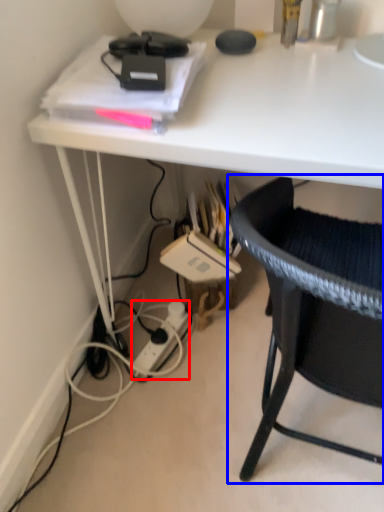
Question: Among these objects, which one is nearest to the camera, power outlet (highlighted by a red box) or chair (highlighted by a blue box)?

Choices:
 (A) power outlet
 (B) chair

Answer: (B)